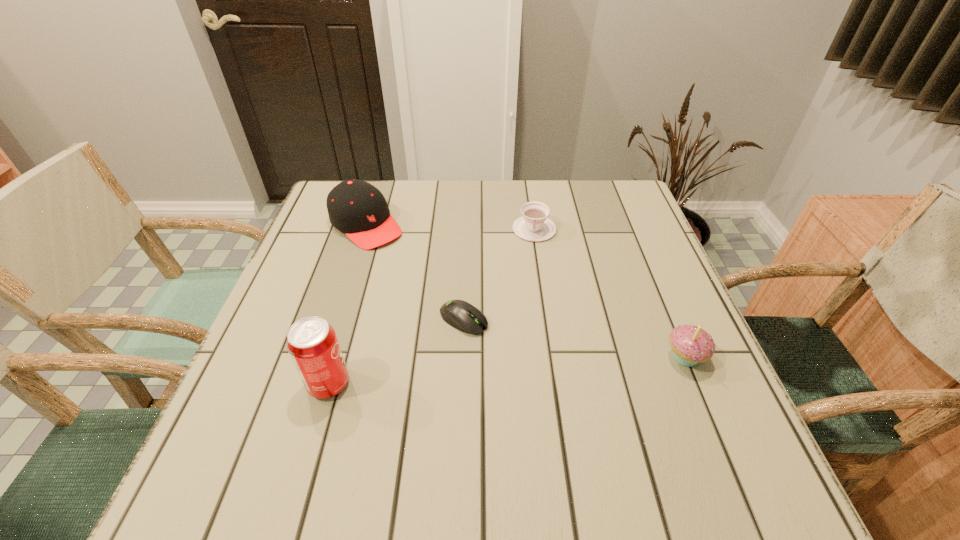
You are a GUI agent. You are given a task and a screenshot of the screen. Output one action in this format:
    pyautogui.click(x=<x>, y=<y>)
    Task: Click on the object at the near edge
    Image resolution: width=960 pixels, height=540 pixels.
    Given the screenshot: What is the action you would take?
    pyautogui.click(x=312, y=343)

The image size is (960, 540). Identify the location of soda that is at the left edge. (312, 343).

Where is `cap situated at the left edge`? cap situated at the left edge is located at coordinates (355, 207).

Identify the location of object that is at the right edge. (690, 344).

At what (x,y) coordinates should I click in order to perform the action: click on object present at the far left corner. Please return your answer as a coordinate pair (x, y). This screenshot has width=960, height=540. Looking at the image, I should click on (355, 207).

In order to click on object present at the near left corner in this screenshot , I will do `click(312, 343)`.

In order to click on vacant space at the far edge in this screenshot , I will do `click(524, 199)`.

This screenshot has height=540, width=960. In order to click on vacant space at the left edge of the desktop in this screenshot , I will do `click(353, 262)`.

Locate an element on the screen. free location at the right edge is located at coordinates (606, 249).

Locate an element on the screen. vacant point at the far left corner is located at coordinates (315, 221).